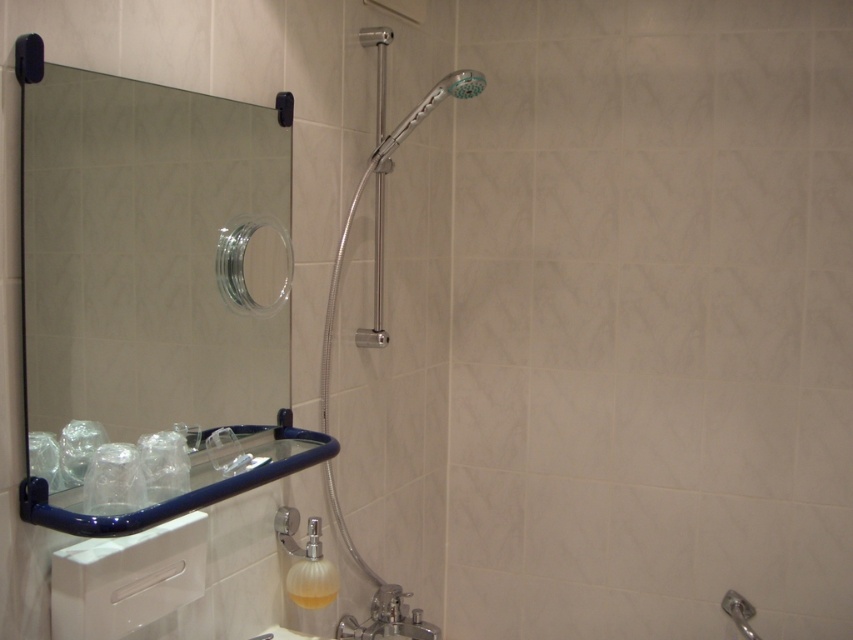
Measure the distance between point (167,356) and camera.

3.77 feet

Based on the photo, is transparent glass mirror at left thinner than translucent plastic soap dispenser at lower center?

No, transparent glass mirror at left is not thinner than translucent plastic soap dispenser at lower center.

At what (x,y) coordinates should I click in order to perform the action: click on transparent glass mirror at left. Please return your answer as a coordinate pair (x, y). The height and width of the screenshot is (640, 853). Looking at the image, I should click on (148, 252).

Find the location of a particular element. transparent glass mirror at left is located at coordinates (148, 252).

Can you confirm if translucent plastic soap dispenser at lower center is positioned above silver metallic shower head at upper center?

No, translucent plastic soap dispenser at lower center is not above silver metallic shower head at upper center.

Who is more forward, (334, 573) or (397, 138)?

Positioned in front is point (334, 573).

Image resolution: width=853 pixels, height=640 pixels. I want to click on translucent plastic soap dispenser at lower center, so click(312, 573).

Identify the location of translucent plastic soap dispenser at lower center. (312, 573).

Between transparent glass mirror at left and polished chrome shower head at upper center, which one has more height?

polished chrome shower head at upper center is taller.

What do you see at coordinates (148, 252) in the screenshot? I see `transparent glass mirror at left` at bounding box center [148, 252].

Describe the element at coordinates (148, 252) in the screenshot. This screenshot has height=640, width=853. I see `transparent glass mirror at left` at that location.

Where is `transparent glass mirror at left`? Image resolution: width=853 pixels, height=640 pixels. transparent glass mirror at left is located at coordinates (148, 252).